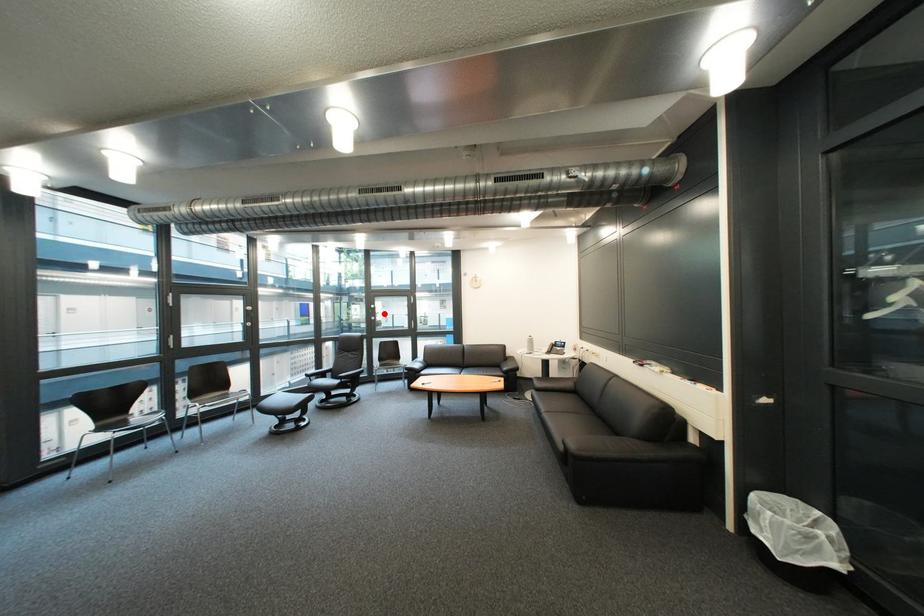
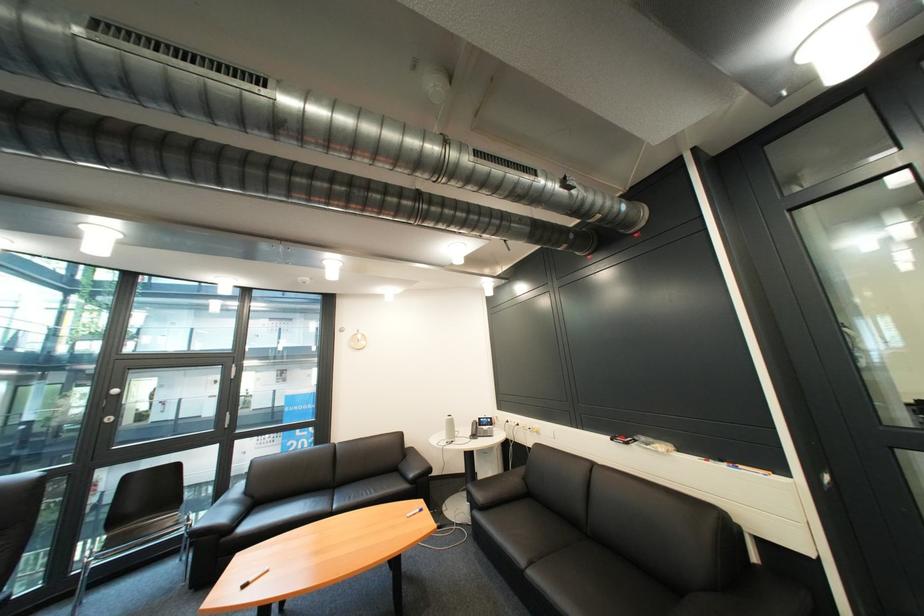
Question: A red point is marked in image1. In image2, is the corresponding 3D point closer to the camera or farther? Reply with the corresponding letter.

Choices:
 (A) The corresponding 3D point is closer.
 (B) The corresponding 3D point is farther.

Answer: (A)